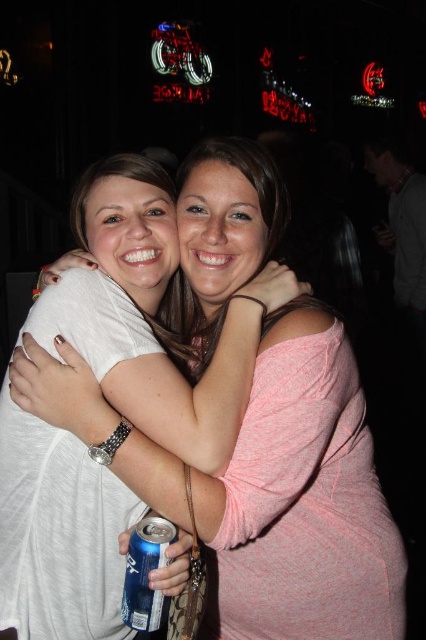
Question: Which point is farther to the camera?

Choices:
 (A) (138, 602)
 (B) (296, 333)

Answer: (B)

Question: Which object appears closest to the camera in this image?

Choices:
 (A) blue metallic can at lower center
 (B) pink fabric shirt at center

Answer: (A)

Question: From the image, what is the correct spatial relationship of pink fabric shirt at center in relation to blue metallic can at lower center?

Choices:
 (A) left
 (B) right

Answer: (B)

Question: Is the position of pink fabric shirt at center less distant than that of blue metallic can at lower center?

Choices:
 (A) yes
 (B) no

Answer: (B)

Question: Considering the relative positions of pink fabric shirt at center and blue metallic can at lower center in the image provided, where is pink fabric shirt at center located with respect to blue metallic can at lower center?

Choices:
 (A) below
 (B) above

Answer: (B)